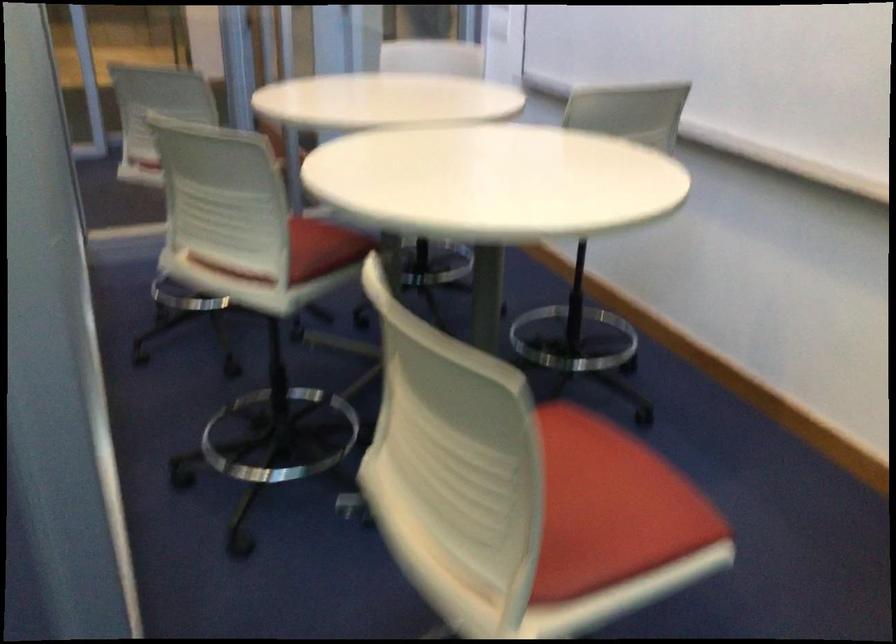
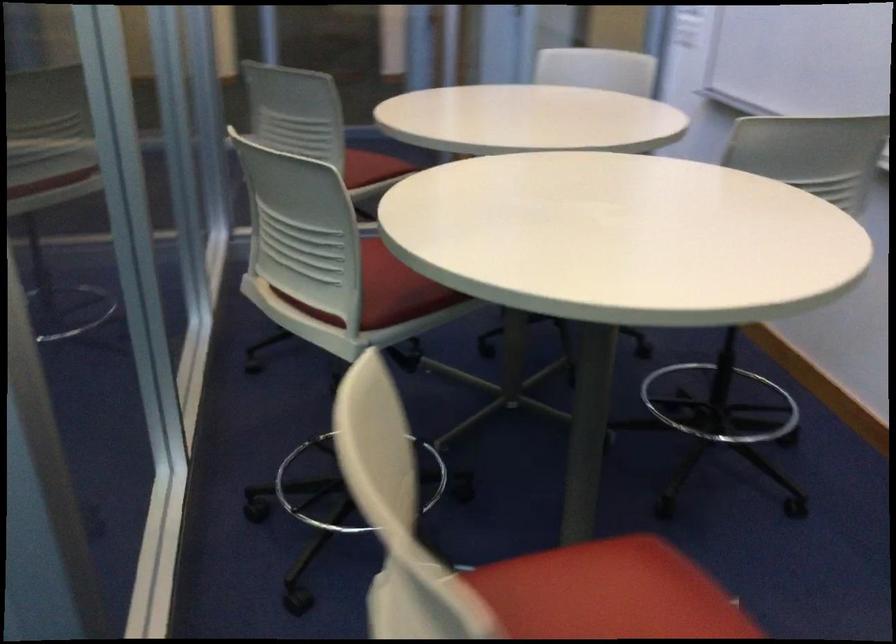
In a continuous first-person perspective shot, in which direction is the camera moving?

The cameraman walked toward right, forward.